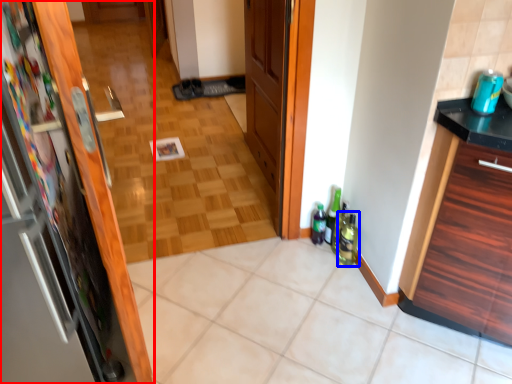
Question: Which of the following is the closest to the observer, door (highlighted by a red box) or beverage (highlighted by a blue box)?

Choices:
 (A) door
 (B) beverage

Answer: (A)